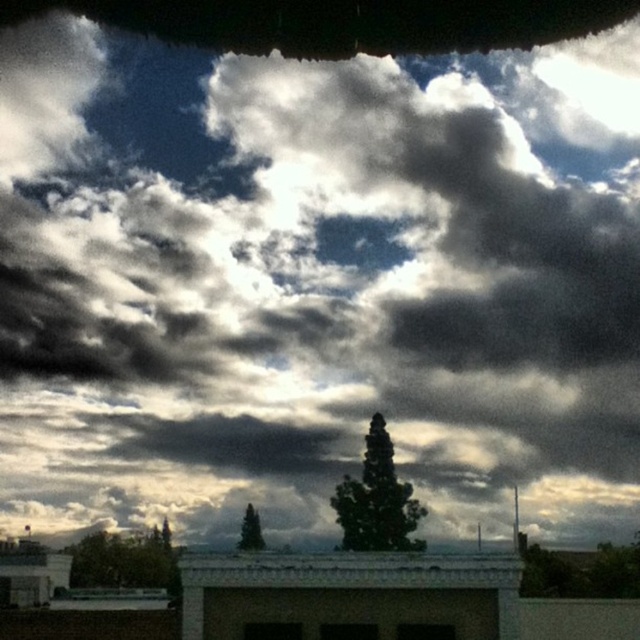
Question: Which point appears closest to the camera in this image?

Choices:
 (A) (612, 570)
 (B) (378, 436)
 (C) (246, 548)
 (D) (120, 561)

Answer: (A)

Question: Can you confirm if green leafy tree at center is thinner than green leafy tree at lower right?

Choices:
 (A) yes
 (B) no

Answer: (A)

Question: Is green leafy tree at center above green leafy tree at lower left?

Choices:
 (A) no
 (B) yes

Answer: (B)

Question: Which object appears farthest from the camera in this image?

Choices:
 (A) green leafy tree at center
 (B) green matte tree at center
 (C) green leafy tree at lower left

Answer: (B)

Question: Does green leafy tree at lower left lie behind green matte tree at center?

Choices:
 (A) yes
 (B) no

Answer: (B)

Question: Which point is closer to the camera taking this photo?

Choices:
 (A) (260, 540)
 (B) (346, 474)
 (C) (621, 577)

Answer: (C)